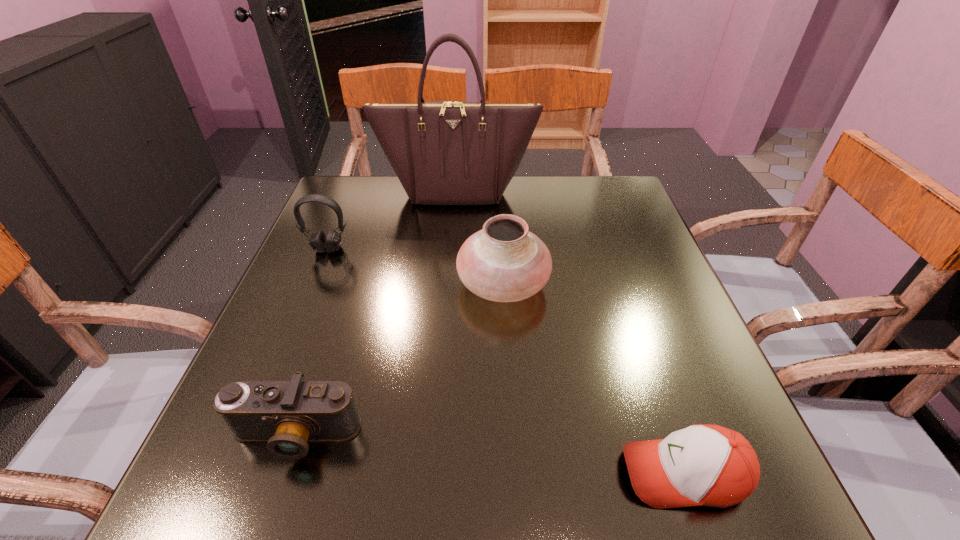
Locate an element on the screen. The image size is (960, 540). object positioned at the near left corner is located at coordinates (287, 414).

At what (x,y) coordinates should I click in order to perform the action: click on object located in the near right corner section of the desktop. Please return your answer as a coordinate pair (x, y). This screenshot has width=960, height=540. Looking at the image, I should click on [x=702, y=465].

Where is `blank space at the far edge of the desktop`? blank space at the far edge of the desktop is located at coordinates (434, 218).

Where is `vacant space at the near edge`? vacant space at the near edge is located at coordinates (411, 500).

Find the location of a particular element. Image resolution: width=960 pixels, height=540 pixels. free spot at the left edge of the desktop is located at coordinates (295, 267).

Locate an element on the screen. Image resolution: width=960 pixels, height=540 pixels. free location at the right edge is located at coordinates (685, 368).

Find the location of a particular element. vacant space at the far left corner of the desktop is located at coordinates (341, 190).

I want to click on vacant space at the far right corner, so click(x=594, y=179).

Image resolution: width=960 pixels, height=540 pixels. Find the location of `free area in between the rightmost object and the pottery`. free area in between the rightmost object and the pottery is located at coordinates (593, 379).

Locate an element on the screen. The image size is (960, 540). free area in between the headset and the farthest object is located at coordinates (393, 220).